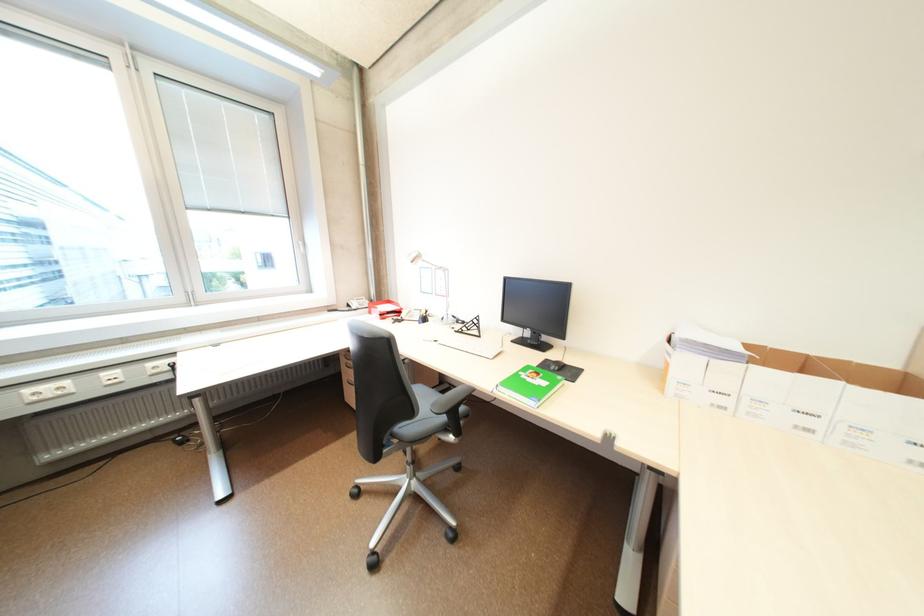
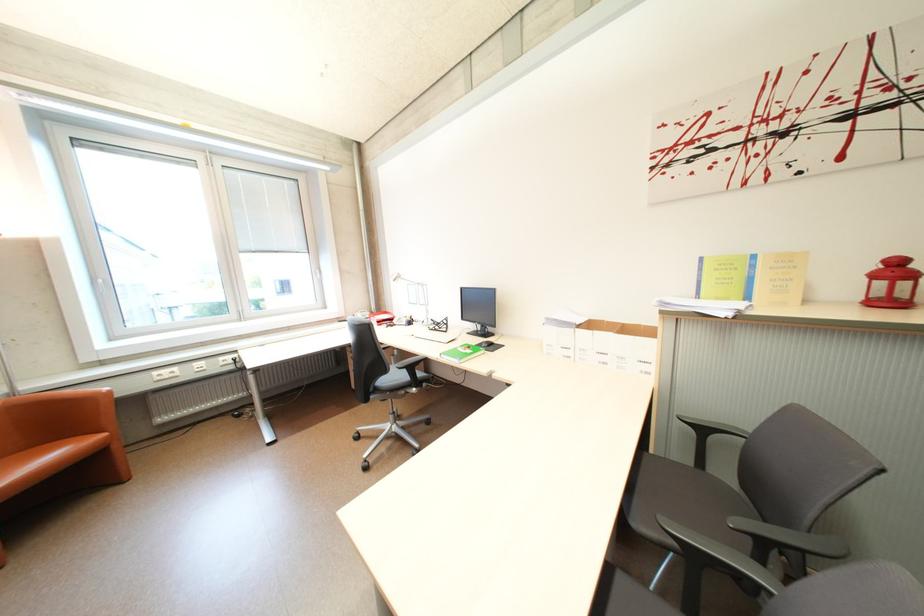
Question: How did the camera likely rotate?

Choices:
 (A) Left
 (B) Right
 (C) Up
 (D) Down

Answer: (C)